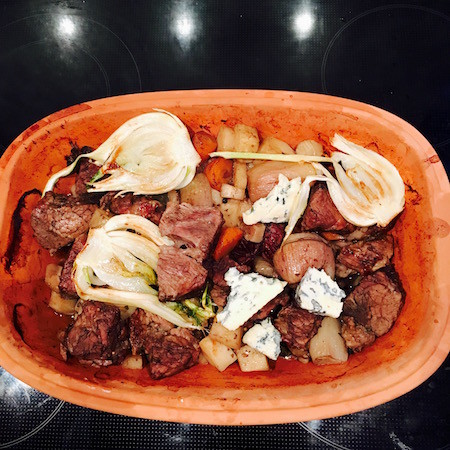
Identify the location of stovetop. (279, 435).